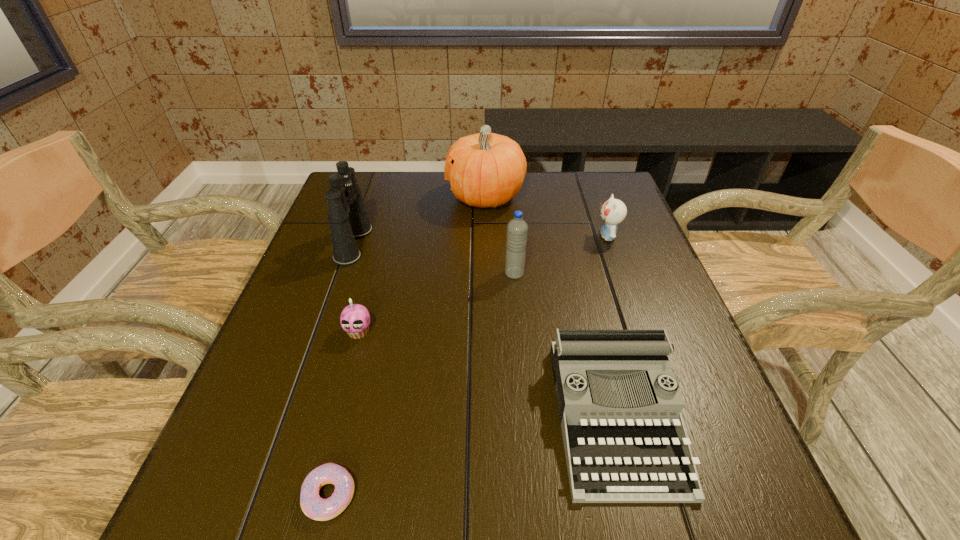
This screenshot has height=540, width=960. Identify the location of free space located 0.210m on the front-facing side of the pumpkin. (375, 197).

At what (x,y) coordinates should I click in order to perform the action: click on free space located 0.200m on the back of the leftmost object. Please return your answer as a coordinate pair (x, y). Image resolution: width=960 pixels, height=540 pixels. Looking at the image, I should click on (373, 186).

Locate an element on the screen. free space located 0.310m on the back of the water bottle is located at coordinates (508, 199).

I want to click on vacant space located on the front-facing side of the fourth tallest object, so [x=508, y=237].

The image size is (960, 540). Find the location of `vacant space located 0.230m on the front-facing side of the fourth tallest object`. vacant space located 0.230m on the front-facing side of the fourth tallest object is located at coordinates (508, 237).

I want to click on vacant space situated on the front-facing side of the fourth tallest object, so click(x=518, y=237).

I want to click on vacant point located 0.230m on the face of the cupcake, so click(x=326, y=451).

You are a GUI agent. You are given a task and a screenshot of the screen. Output one action in this format:
    pyautogui.click(x=<x>, y=<y>)
    Task: Click on the vacant region located 0.350m on the back of the shortest object
    This screenshot has width=960, height=540.
    Given the screenshot: What is the action you would take?
    pos(374,310)

Locate an element on the screen. This screenshot has width=960, height=540. object at the far edge is located at coordinates (485, 169).

Where is `typewriter present at the near edge`? typewriter present at the near edge is located at coordinates (620, 406).